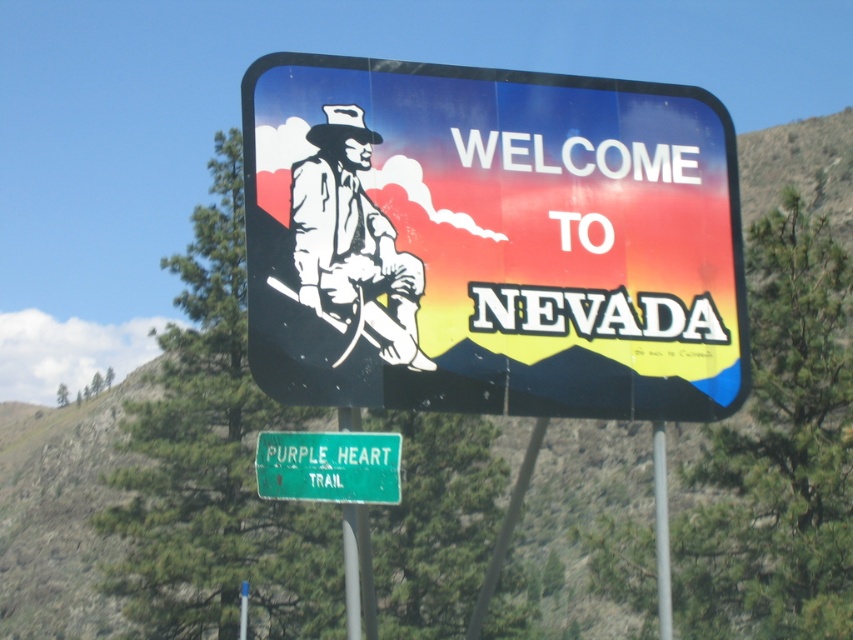
Who is taller, white matte cowboy at center or green metallic sign at lower center?

white matte cowboy at center

The height and width of the screenshot is (640, 853). Identify the location of white matte cowboy at center. (352, 241).

Does matte plastic signboard at center have a smaller size compared to metallic gray pole at center?

Correct, matte plastic signboard at center occupies less space than metallic gray pole at center.

Does matte plastic signboard at center appear under metallic gray pole at center?

No.

What do you see at coordinates (491, 241) in the screenshot?
I see `matte plastic signboard at center` at bounding box center [491, 241].

Where is `matte plastic signboard at center`? This screenshot has width=853, height=640. matte plastic signboard at center is located at coordinates (491, 241).

Does green metallic sign at lower center have a lesser height compared to green metal signpost at center?

Correct, green metallic sign at lower center is not as tall as green metal signpost at center.

Between green metallic sign at lower center and green metal signpost at center, which one has less height?

green metallic sign at lower center is shorter.

Between point (316, 492) and point (338, 413), which one is positioned in front?

Point (316, 492) is more forward.

Identify the location of green metallic sign at lower center. This screenshot has width=853, height=640. (329, 467).